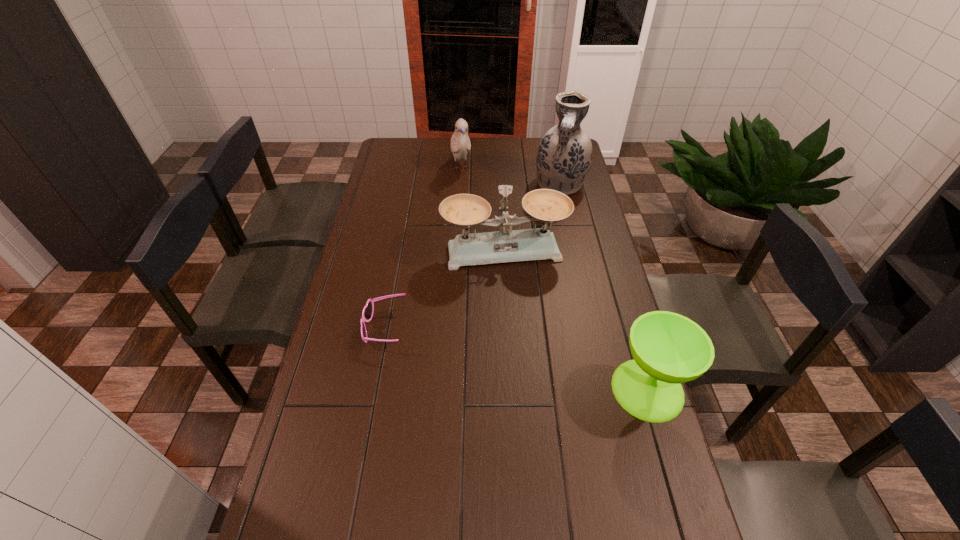
The width and height of the screenshot is (960, 540). In order to click on wineglass present at the right edge in this screenshot , I will do `click(668, 349)`.

Where is `vase located in the right edge section of the desktop`? vase located in the right edge section of the desktop is located at coordinates (564, 155).

The height and width of the screenshot is (540, 960). Find the location of `scale located in the right edge section of the desktop`. scale located in the right edge section of the desktop is located at coordinates (546, 205).

Where is `vacant space at the far edge of the desktop`? vacant space at the far edge of the desktop is located at coordinates (416, 162).

At what (x,y) coordinates should I click in order to perform the action: click on free space at the near edge of the desktop. Please return your answer as a coordinate pair (x, y). This screenshot has height=540, width=960. Looking at the image, I should click on (392, 512).

Image resolution: width=960 pixels, height=540 pixels. Identify the location of free space at the left edge of the desktop. (389, 231).

Image resolution: width=960 pixels, height=540 pixels. I want to click on vacant space at the right edge, so click(x=576, y=228).

In the image, there is a desktop. At what (x,y) coordinates should I click in order to perform the action: click on vacant space at the near right corner. Please return your answer as a coordinate pair (x, y). This screenshot has height=540, width=960. Looking at the image, I should click on (626, 536).

This screenshot has width=960, height=540. Identify the location of free point between the scale and the shortest object. tap(444, 290).

The width and height of the screenshot is (960, 540). Find the location of `unoccupied area between the vase and the bird`. unoccupied area between the vase and the bird is located at coordinates (511, 177).